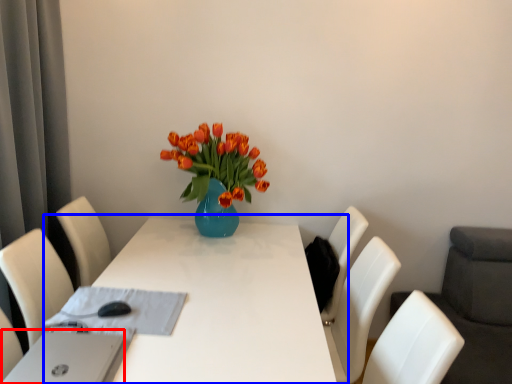
Question: Which object appears farthest to the camera in this image, computer (highlighted by a red box) or table (highlighted by a blue box)?

Choices:
 (A) computer
 (B) table

Answer: (B)